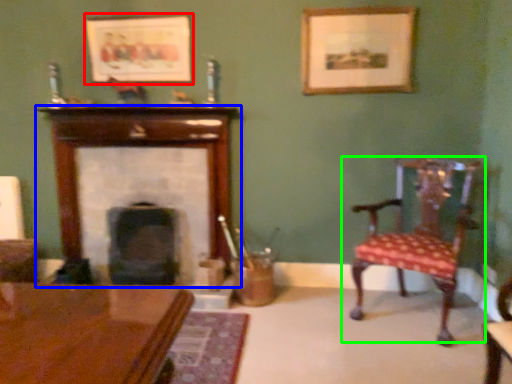
Question: Based on their relative distances, which object is farther from picture frame (highlighted by a red box)? Choose from fireplace (highlighted by a blue box) and chair (highlighted by a green box).

Choices:
 (A) fireplace
 (B) chair

Answer: (B)